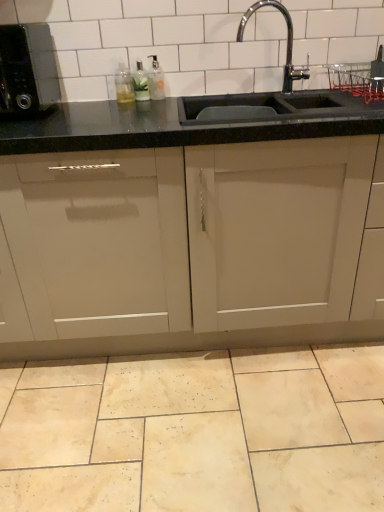
The height and width of the screenshot is (512, 384). What do you see at coordinates (228, 256) in the screenshot? I see `matte beige cabinet at center` at bounding box center [228, 256].

You are a GUI agent. You are given a task and a screenshot of the screen. Output one action in this format:
    pyautogui.click(x=<x>, y=<y>)
    Task: Click on the black matte microwave at left
    The width and height of the screenshot is (384, 512).
    Given the screenshot: What is the action you would take?
    pyautogui.click(x=27, y=69)

The height and width of the screenshot is (512, 384). What are the coordinates of `translucent plastic bottle at upper left, the 3th bottle positioned from the right` in the screenshot? It's located at (124, 85).

Is black granite sink at upper center shorter than beige marble tile at lower center?

Incorrect, the height of black granite sink at upper center does not fall short of that of beige marble tile at lower center.

Would you consider black granite sink at upper center to be distant from beige marble tile at lower center?

That's right, there is a large distance between black granite sink at upper center and beige marble tile at lower center.

Looking at this image, between black granite sink at upper center and beige marble tile at lower center, which one appears on the right side from the viewer's perspective?

black granite sink at upper center.

Looking at their sizes, would you say black granite sink at upper center is wider or thinner than beige marble tile at lower center?

Clearly, black granite sink at upper center has less width compared to beige marble tile at lower center.

Which is less distant, (x=143, y=89) or (x=117, y=85)?

Point (x=143, y=89).

From the picture: Which object is further away from the camera, translucent glass bottle at upper left, arranged as the second bottle when viewed from the left, or translucent plastic bottle at upper left, the 3th bottle positioned from the right?

translucent plastic bottle at upper left, the 3th bottle positioned from the right, is behind.

From the image's perspective, is translucent glass bottle at upper left, arranged as the second bottle when viewed from the left, located above or below translucent plastic bottle at upper left, which ranks as the 1th bottle in left-to-right order?

translucent glass bottle at upper left, arranged as the second bottle when viewed from the left, is above translucent plastic bottle at upper left, which ranks as the 1th bottle in left-to-right order.

Is translucent glass bottle at upper left, arranged as the second bottle when viewed from the left, wider than translucent plastic bottle at upper left, the 3th bottle positioned from the right?

Yes, translucent glass bottle at upper left, arranged as the second bottle when viewed from the left, is wider than translucent plastic bottle at upper left, the 3th bottle positioned from the right.

Is beige marble tile at lower center turned away from translucent glass bottle at upper left, the second bottle when ordered from right to left?

beige marble tile at lower center is not turned away from translucent glass bottle at upper left, the second bottle when ordered from right to left.

Can we say beige marble tile at lower center lies outside translucent glass bottle at upper left, arranged as the second bottle when viewed from the left?

Yes, beige marble tile at lower center is located beyond the bounds of translucent glass bottle at upper left, arranged as the second bottle when viewed from the left.

Does point (155, 415) lie behind point (148, 93)?

That is False.

Which object is further away from the camera, black matte microwave at left or clear glass bottle at upper center, the third bottle in the left-to-right sequence?

clear glass bottle at upper center, the third bottle in the left-to-right sequence.

Can you confirm if black matte microwave at left is thinner than clear glass bottle at upper center, the third bottle in the left-to-right sequence?

No, black matte microwave at left is not thinner than clear glass bottle at upper center, the third bottle in the left-to-right sequence.

At what (x,y) coordinates should I click in order to perform the action: click on bottle that is the 3rd one when counting rightward from the black matte microwave at left. Please return your answer as a coordinate pair (x, y). This screenshot has width=384, height=512. Looking at the image, I should click on (156, 80).

Is black granite sink at upper center facing away from translucent glass bottle at upper left, the second bottle when ordered from right to left?

black granite sink at upper center does not have its back to translucent glass bottle at upper left, the second bottle when ordered from right to left.

Find the location of a particular element. Image resolution: width=384 pixels, height=512 pixels. sink below the translucent glass bottle at upper left, the second bottle when ordered from right to left (from a real-world perspective) is located at coordinates (249, 93).

Is black granite sink at upper center spatially inside translucent glass bottle at upper left, arranged as the second bottle when viewed from the left, or outside of it?

black granite sink at upper center is outside translucent glass bottle at upper left, arranged as the second bottle when viewed from the left.

Looking at this image, is black granite sink at upper center beside translucent glass bottle at upper left, arranged as the second bottle when viewed from the left?

black granite sink at upper center is not next to translucent glass bottle at upper left, arranged as the second bottle when viewed from the left, and they're not touching.

Is beige marble tile at lower center facing away from clear glass bottle at upper center, which is the first bottle from right to left?

beige marble tile at lower center is not turned away from clear glass bottle at upper center, which is the first bottle from right to left.

From the image's perspective, which is below, beige marble tile at lower center or clear glass bottle at upper center, the third bottle in the left-to-right sequence?

From the image's view, beige marble tile at lower center is below.

How many degrees apart are the facing directions of beige marble tile at lower center and clear glass bottle at upper center, the third bottle in the left-to-right sequence?

They differ by 0.334 degrees in their facing directions.

Is clear glass bottle at upper center, which is the first bottle from right to left, completely or partially inside beige marble tile at lower center?

Actually, clear glass bottle at upper center, which is the first bottle from right to left, is outside beige marble tile at lower center.

Considering the sizes of objects clear glass bottle at upper center, the third bottle in the left-to-right sequence, and matte beige cabinet at center in the image provided, who is bigger, clear glass bottle at upper center, the third bottle in the left-to-right sequence, or matte beige cabinet at center?

matte beige cabinet at center.

Could you measure the distance between clear glass bottle at upper center, the third bottle in the left-to-right sequence, and matte beige cabinet at center?

The distance of clear glass bottle at upper center, the third bottle in the left-to-right sequence, from matte beige cabinet at center is 84.19 centimeters.

Does clear glass bottle at upper center, which is the first bottle from right to left, have a lesser width compared to matte beige cabinet at center?

Yes.

Considering the sizes of objects clear glass bottle at upper center, the third bottle in the left-to-right sequence, and matte beige cabinet at center in the image provided, who is taller, clear glass bottle at upper center, the third bottle in the left-to-right sequence, or matte beige cabinet at center?

matte beige cabinet at center.

The width and height of the screenshot is (384, 512). I want to click on ceramic tile to the left of black granite sink at upper center, so click(196, 432).

Find the location of a particular element. This screenshot has height=512, width=384. bottle below the translucent glass bottle at upper left, arranged as the second bottle when viewed from the left (from the image's perspective) is located at coordinates (124, 85).

Which object lies nearer to the anchor point beige marble tile at lower center, translucent plastic bottle at upper left, the 3th bottle positioned from the right, or matte beige cabinet at center?

Among the two, matte beige cabinet at center is located nearer to beige marble tile at lower center.

From the picture: From the image, which object appears to be nearer to matte beige cabinet at center, translucent glass bottle at upper left, the second bottle when ordered from right to left, or black granite sink at upper center?

The object closer to matte beige cabinet at center is black granite sink at upper center.

Based on their spatial positions, is clear glass bottle at upper center, the third bottle in the left-to-right sequence, or matte beige cabinet at center further from translucent plastic bottle at upper left, which ranks as the 1th bottle in left-to-right order?

matte beige cabinet at center is further to translucent plastic bottle at upper left, which ranks as the 1th bottle in left-to-right order.

When comparing their distances from beige marble tile at lower center, does black matte microwave at left or clear glass bottle at upper center, which is the first bottle from right to left, seem closer?

Based on the image, black matte microwave at left appears to be nearer to beige marble tile at lower center.

Based on their spatial positions, is black matte microwave at left or beige marble tile at lower center further from clear glass bottle at upper center, which is the first bottle from right to left?

Among the two, beige marble tile at lower center is located further to clear glass bottle at upper center, which is the first bottle from right to left.

Considering their positions, is beige marble tile at lower center positioned closer to black matte microwave at left than matte beige cabinet at center?

matte beige cabinet at center.

When comparing their distances from translucent glass bottle at upper left, arranged as the second bottle when viewed from the left, does translucent plastic bottle at upper left, the 3th bottle positioned from the right, or black granite sink at upper center seem closer?

The object closer to translucent glass bottle at upper left, arranged as the second bottle when viewed from the left, is translucent plastic bottle at upper left, the 3th bottle positioned from the right.

When comparing their distances from matte beige cabinet at center, does beige marble tile at lower center or clear glass bottle at upper center, which is the first bottle from right to left, seem further?

clear glass bottle at upper center, which is the first bottle from right to left.

The height and width of the screenshot is (512, 384). I want to click on cabinetry between black matte microwave at left and black granite sink at upper center from left to right, so [x=228, y=256].

This screenshot has width=384, height=512. In order to click on sink between translucent plastic bottle at upper left, the 3th bottle positioned from the right, and beige marble tile at lower center in the up-down direction in this screenshot , I will do `click(249, 93)`.

You are a GUI agent. You are given a task and a screenshot of the screen. Output one action in this format:
    pyautogui.click(x=<x>, y=<y>)
    Task: Click on the cabinetry between clear glass bottle at upper center, the third bottle in the left-to-right sequence, and beige marble tile at lower center vertically
    This screenshot has width=384, height=512.
    Given the screenshot: What is the action you would take?
    pyautogui.click(x=228, y=256)

This screenshot has width=384, height=512. I want to click on sink between clear glass bottle at upper center, the third bottle in the left-to-right sequence, and beige marble tile at lower center, in the vertical direction, so click(x=249, y=93).